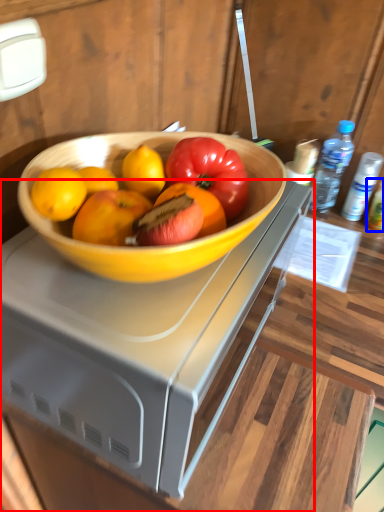
Question: Which point is further to the camera, desk (highlighted by a red box) or bottle (highlighted by a blue box)?

Choices:
 (A) desk
 (B) bottle

Answer: (B)